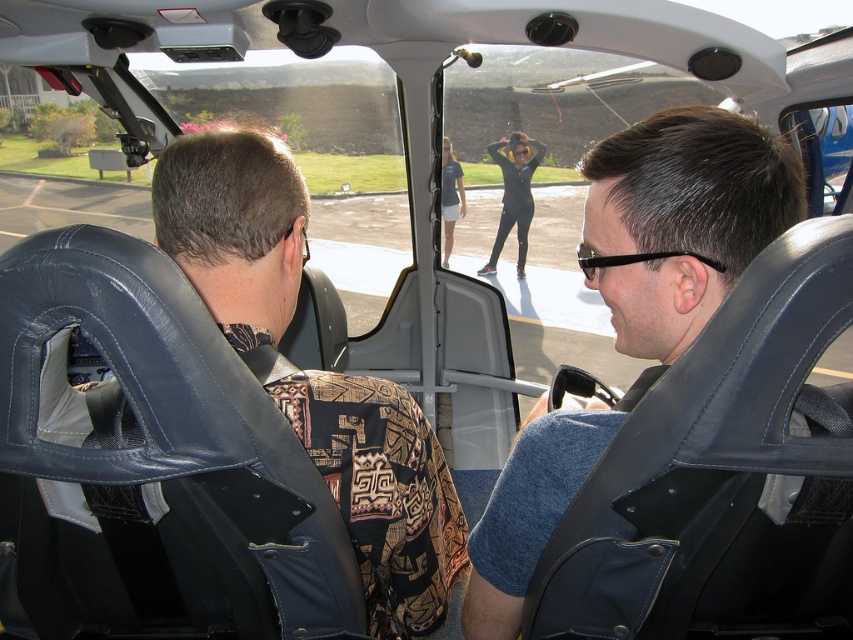
Question: Does blue fabric shirt at center appear under matte black seat at left?

Choices:
 (A) yes
 (B) no

Answer: (B)

Question: Which point is closer to the camera?

Choices:
 (A) (495, 241)
 (B) (305, 221)

Answer: (B)

Question: Does blue fabric shirt at center come in front of matte black seat at left?

Choices:
 (A) no
 (B) yes

Answer: (A)

Question: Estimate the real-world distances between objects in this image. Which object is closer to the blue fabric shirt at center?

Choices:
 (A) matte black seat at left
 (B) black matte pants at center

Answer: (A)

Question: Which point is farther to the camera?

Choices:
 (A) matte black seat at left
 (B) blue fabric shirt at center
 (C) black matte pants at center

Answer: (C)

Question: Does blue fabric shirt at center appear under black matte pants at center?

Choices:
 (A) yes
 (B) no

Answer: (A)